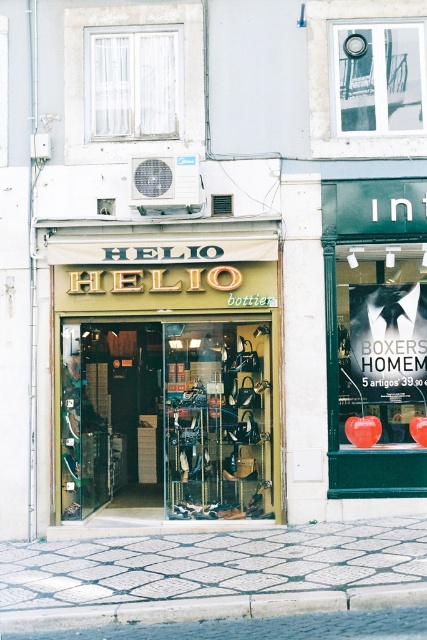
Question: Which point is closer to the camera?

Choices:
 (A) matte black poster at center right
 (B) white sheer curtain at upper left
 (C) transparent glass door at upper center

Answer: (A)

Question: Among these points, which one is farthest from the camera?

Choices:
 (A) (145, 122)
 (B) (35, 628)

Answer: (A)

Question: Is matte gold signboard at center above white textured pavement at lower center?

Choices:
 (A) no
 (B) yes

Answer: (B)

Question: Estimate the real-world distances between objects in this image. Which object is farther from the white sheer curtain at upper left?

Choices:
 (A) transparent glass door at upper center
 (B) matte black poster at center right
 (C) concrete at lower center

Answer: (C)

Question: Does white textured pavement at lower center have a larger size compared to transparent glass door at upper center?

Choices:
 (A) no
 (B) yes

Answer: (B)

Question: In this image, where is matte gold signboard at center located relative to concrete at lower center?

Choices:
 (A) left
 (B) right

Answer: (A)